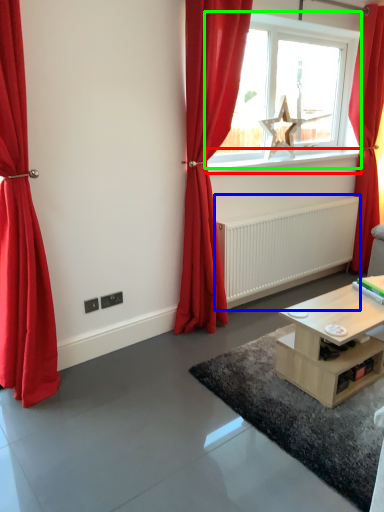
Question: Considering the real-world distances, which object is farthest from window sill (highlighted by a red box)? radiator (highlighted by a blue box) or window (highlighted by a green box)?

Choices:
 (A) radiator
 (B) window

Answer: (A)